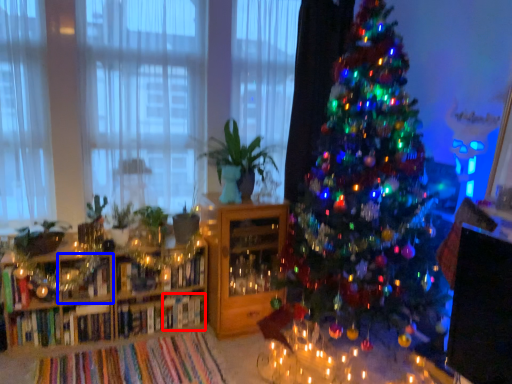
Question: Which point is further to the camera, book (highlighted by a red box) or shelf (highlighted by a blue box)?

Choices:
 (A) book
 (B) shelf

Answer: (A)